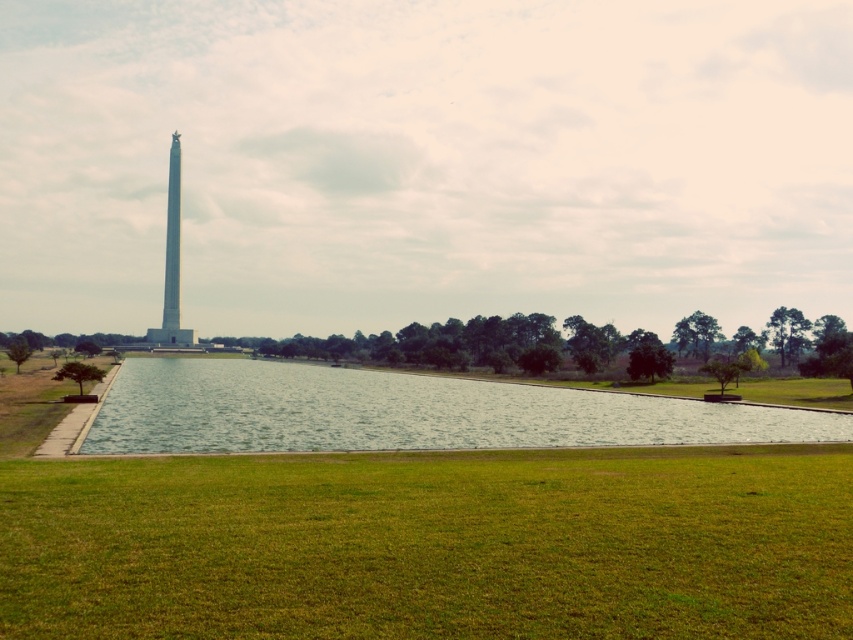
Question: Which point is farther to the camera?

Choices:
 (A) (164, 307)
 (B) (816, 632)

Answer: (A)

Question: Which of these objects is positioned closest to the white marble tower at center?

Choices:
 (A) green grass at lower center
 (B) green grassy lake at center

Answer: (B)

Question: Is green grass at lower center wider than white marble tower at center?

Choices:
 (A) yes
 (B) no

Answer: (A)

Question: Among these objects, which one is nearest to the camera?

Choices:
 (A) green grassy lake at center
 (B) green grass at lower center

Answer: (B)

Question: Is green grass at lower center to the right of green grassy lake at center from the viewer's perspective?

Choices:
 (A) yes
 (B) no

Answer: (A)

Question: Does green grassy lake at center appear over white marble tower at center?

Choices:
 (A) no
 (B) yes

Answer: (A)